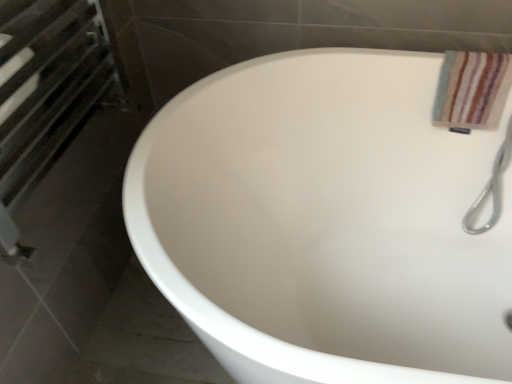
Question: Is white glossy bathtub at center smaller than matte metal towel rack at left?

Choices:
 (A) no
 (B) yes

Answer: (A)

Question: Is white glossy bathtub at center touching matte metal towel rack at left?

Choices:
 (A) yes
 (B) no

Answer: (B)

Question: Does white glossy bathtub at center appear on the right side of matte metal towel rack at left?

Choices:
 (A) no
 (B) yes

Answer: (B)

Question: Is matte metal towel rack at left a part of white glossy bathtub at center?

Choices:
 (A) yes
 (B) no

Answer: (B)

Question: Is white glossy bathtub at center closer to the viewer compared to matte metal towel rack at left?

Choices:
 (A) no
 (B) yes

Answer: (B)

Question: From the image's perspective, is matte metal towel rack at left located above or below striped cotton towel at upper right?

Choices:
 (A) above
 (B) below

Answer: (B)

Question: Is matte metal towel rack at left in front of or behind striped cotton towel at upper right in the image?

Choices:
 (A) front
 (B) behind

Answer: (A)

Question: Which is correct: matte metal towel rack at left is inside striped cotton towel at upper right, or outside of it?

Choices:
 (A) inside
 (B) outside

Answer: (B)

Question: From a real-world perspective, is matte metal towel rack at left physically located above or below striped cotton towel at upper right?

Choices:
 (A) above
 (B) below

Answer: (A)

Question: Relative to white glossy bathtub at center, is striped cotton towel at upper right in front or behind?

Choices:
 (A) behind
 (B) front

Answer: (A)

Question: From the image's perspective, is striped cotton towel at upper right located above or below white glossy bathtub at center?

Choices:
 (A) above
 (B) below

Answer: (A)

Question: Considering the positions of striped cotton towel at upper right and white glossy bathtub at center in the image, is striped cotton towel at upper right taller or shorter than white glossy bathtub at center?

Choices:
 (A) short
 (B) tall

Answer: (A)

Question: Is striped cotton towel at upper right wider or thinner than white glossy bathtub at center?

Choices:
 (A) wide
 (B) thin

Answer: (B)

Question: In terms of height, does matte metal towel rack at left look taller or shorter compared to white glossy bathtub at center?

Choices:
 (A) tall
 (B) short

Answer: (B)

Question: Looking at their shapes, would you say matte metal towel rack at left is wider or thinner than white glossy bathtub at center?

Choices:
 (A) thin
 (B) wide

Answer: (A)